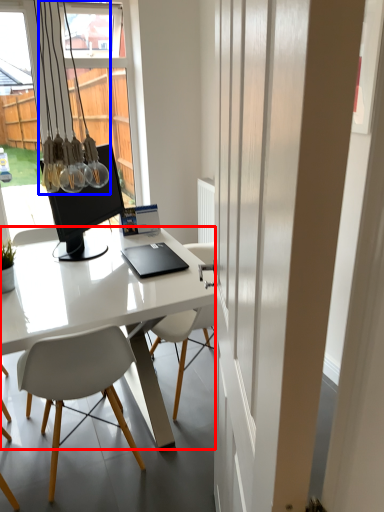
Question: Which of the following is the closest to the observer, desk (highlighted by a red box) or light fixture (highlighted by a blue box)?

Choices:
 (A) desk
 (B) light fixture

Answer: (A)